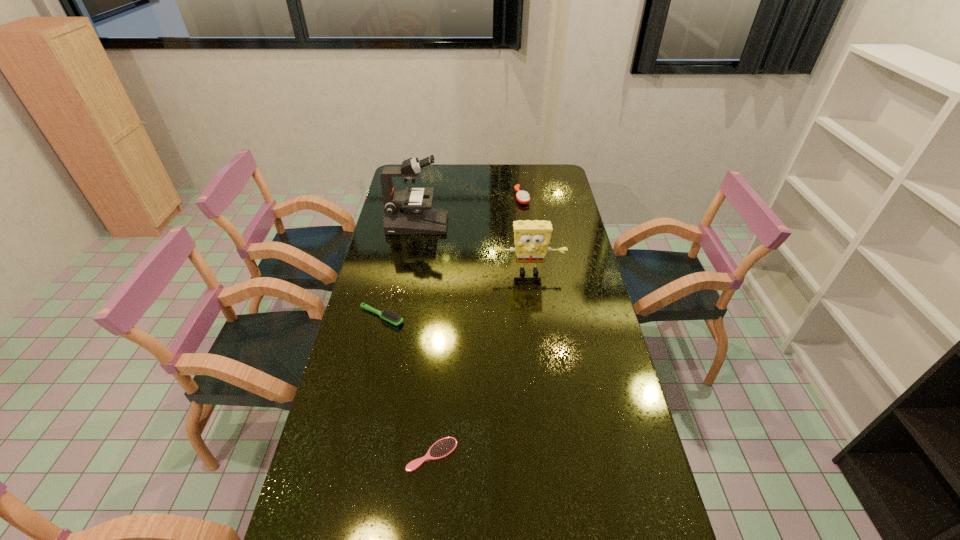
At what (x,y) coordinates should I click in order to perform the action: click on vacant space located through the eyepieces of the fourth nearest object. Please return your answer as a coordinate pair (x, y). The image size is (960, 540). Looking at the image, I should click on (530, 225).

The image size is (960, 540). What are the coordinates of `free space located 0.170m on the face of the sponge` in the screenshot? It's located at (534, 314).

Locate an element on the screen. free space located on the left of the third tallest object is located at coordinates (428, 198).

Identify the location of free space located on the back of the second tallest hairbrush. (389, 284).

The width and height of the screenshot is (960, 540). I want to click on vacant space located 0.130m on the back of the shortest object, so click(437, 395).

Locate an element on the screen. object that is at the far edge is located at coordinates (522, 197).

You are a GUI agent. You are given a task and a screenshot of the screen. Output one action in this format:
    pyautogui.click(x=<x>, y=<y>)
    Task: Click on the microscope that is positioned at the left edge
    
    Given the screenshot: What is the action you would take?
    pyautogui.click(x=406, y=212)

Locate an element on the screen. The width and height of the screenshot is (960, 540). hairbrush present at the left edge is located at coordinates (389, 316).

Find the location of a particular element. object that is positioned at the right edge is located at coordinates (531, 238).

Find the location of `vacant space at the far edge`. vacant space at the far edge is located at coordinates (524, 178).